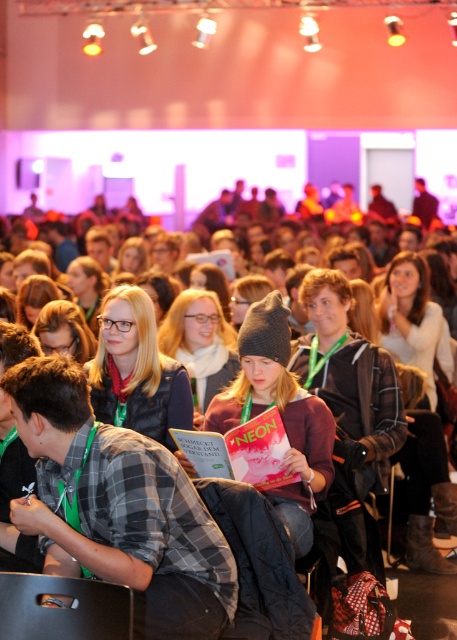
Between knit gray beanie at center and matte black vest at center, which one has less height?

matte black vest at center

In the scene shown: Is knit gray beanie at center above matte black vest at center?

Incorrect, knit gray beanie at center is not positioned above matte black vest at center.

Is point (260, 310) less distant than point (136, 371)?

Yes, it is.

Image resolution: width=457 pixels, height=640 pixels. I want to click on knit gray beanie at center, so click(x=280, y=413).

Who is positioned more to the left, knit gray beanie at center or matte gray beanie at center?

Positioned to the left is matte gray beanie at center.

Based on the photo, who is more forward, (292, 422) or (198, 316)?

Point (292, 422) is in front.

Locate an element on the screen. knit gray beanie at center is located at coordinates [280, 413].

Is point (132, 380) positioned after point (203, 410)?

No, (132, 380) is closer to viewer.

Which is behind, point (116, 385) or point (180, 296)?

Positioned behind is point (180, 296).

Does point (112, 412) come farther from viewer compared to point (228, 364)?

No.

Where is `matte black vest at center`? The image size is (457, 640). matte black vest at center is located at coordinates (137, 371).